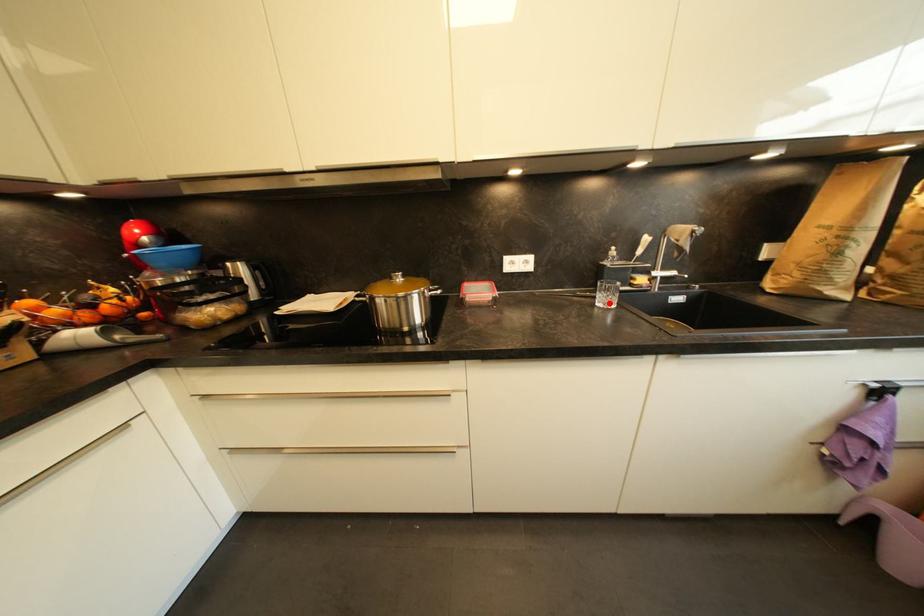
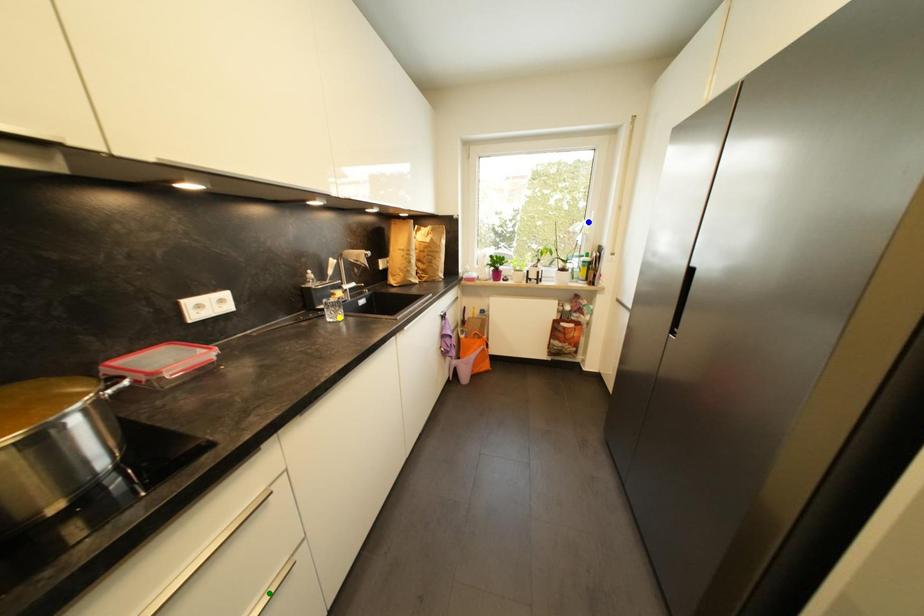
Question: I am providing you with two images of the same scene from different viewpoints. A red point is marked on the first image. You are given multiple points on the second image. Which mark in image 2 goes with the point in image 1?

Choices:
 (A) blue point
 (B) yellow point
 (C) green point

Answer: (B)